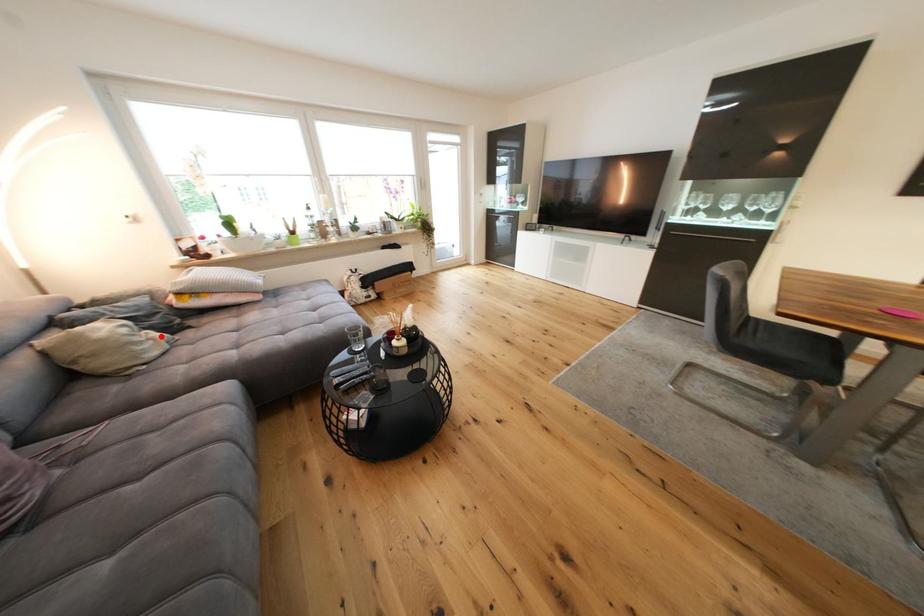
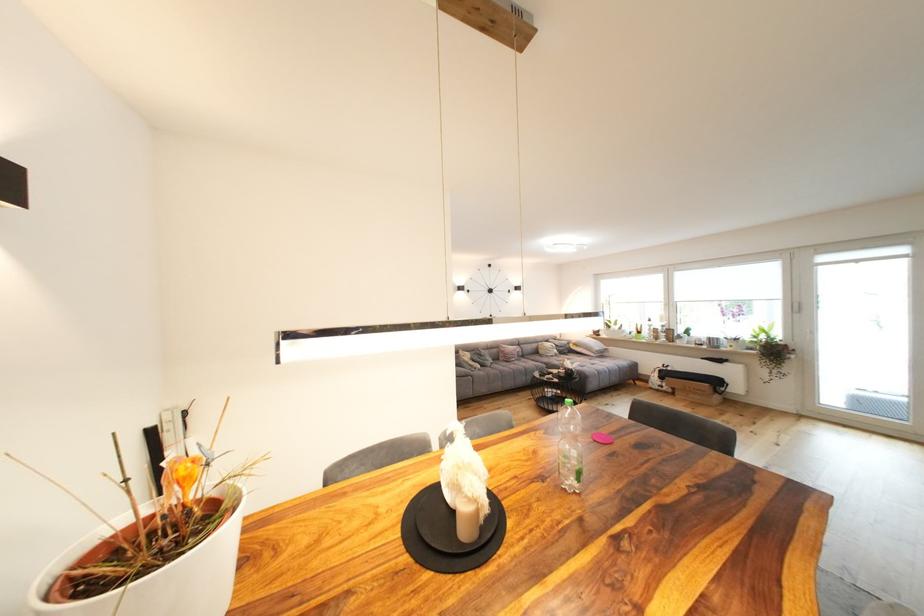
Question: I am providing you with two images of the same scene from different viewpoints. Image1 has a red point marked. In image2, the corresponding 3D location appears at what relative position? Reply with the corresponding letter.

Choices:
 (A) Closer
 (B) Farther

Answer: (B)